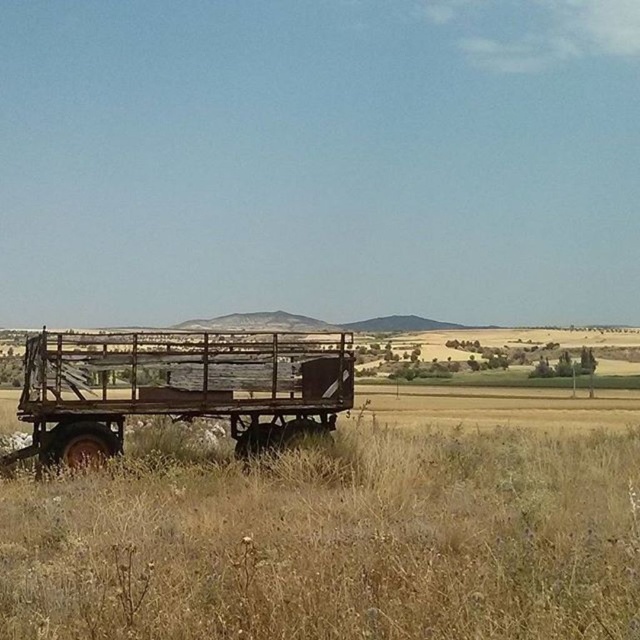
You are standing at the trailer in the foreground of the rural landscape. You see two points marked on the ground ahead of you. The first point is at coordinates point (173, 458) and the second point is at point (104, 380). Which point is closer to you?

Point (173, 458) is closer to you because it is in front of point (104, 380).

You are standing at the edge of the field and want to place a 2.5 meter long fence between the dry grass at lower center and the rusty metal wagon at center. Is there enough space to install the fence without overlapping either object?

The distance between the dry grass at lower center and the rusty metal wagon at center is 2.35 meters. Since the fence is 2.5 meters long, it is slightly longer than the available space. Therefore, the fence cannot be installed without overlapping one or both objects.

You are standing in the middle of the dry grass at lower center and want to move to the rusty metal wagon at center. Which direction should you walk to get there?

Since the dry grass at lower center is bigger than the rusty metal wagon at center, you should walk towards the center of the image where the rusty metal wagon is located.